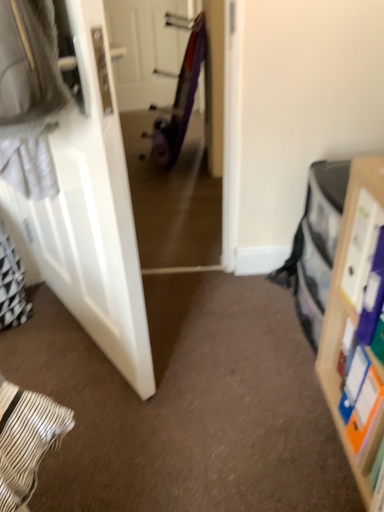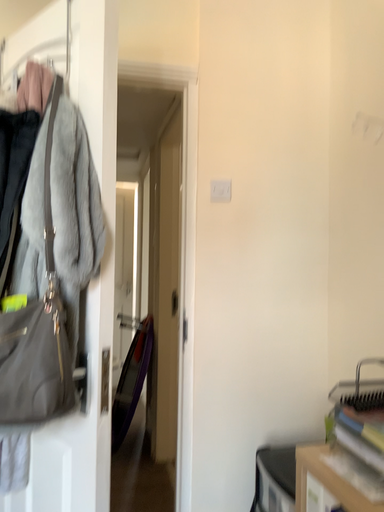
Question: How did the camera likely rotate when shooting the video?

Choices:
 (A) rotated downward
 (B) rotated upward

Answer: (B)